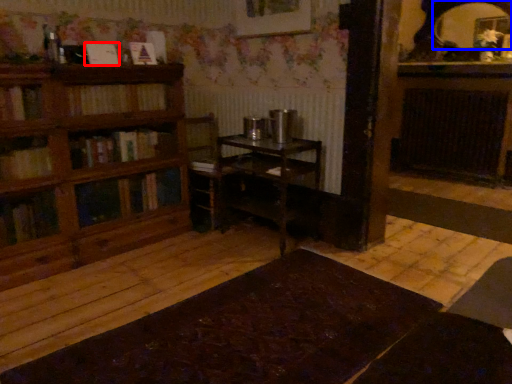
Question: Which point is closer to the camera, book (highlighted by a red box) or mirror (highlighted by a blue box)?

Choices:
 (A) book
 (B) mirror

Answer: (A)